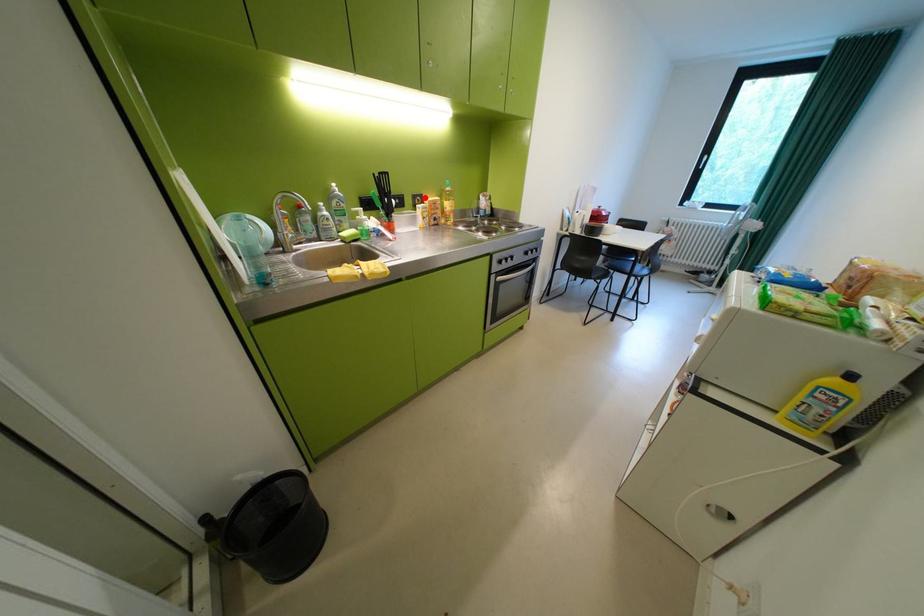
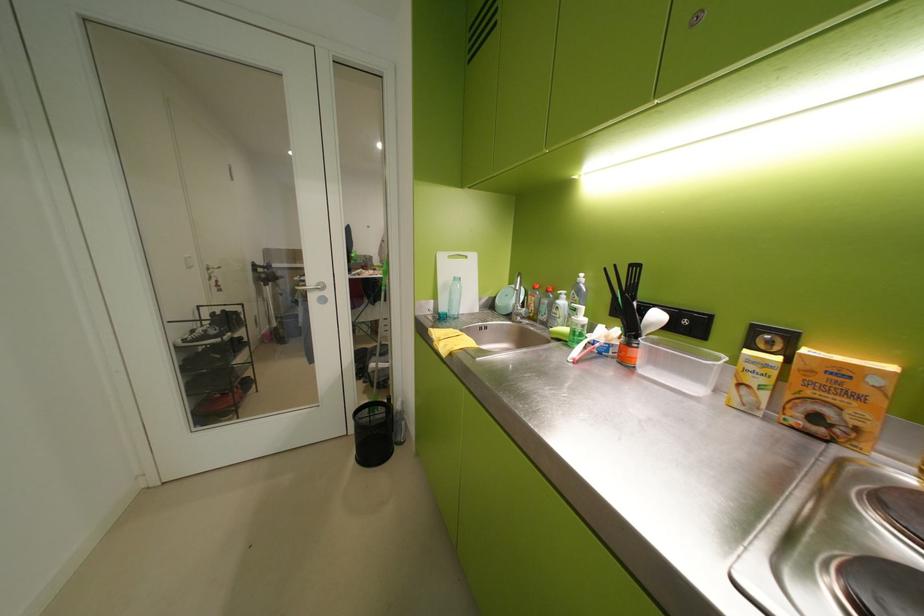
In the second image, find the point that corresponds to the highlighted location in the first image.

(767, 331)